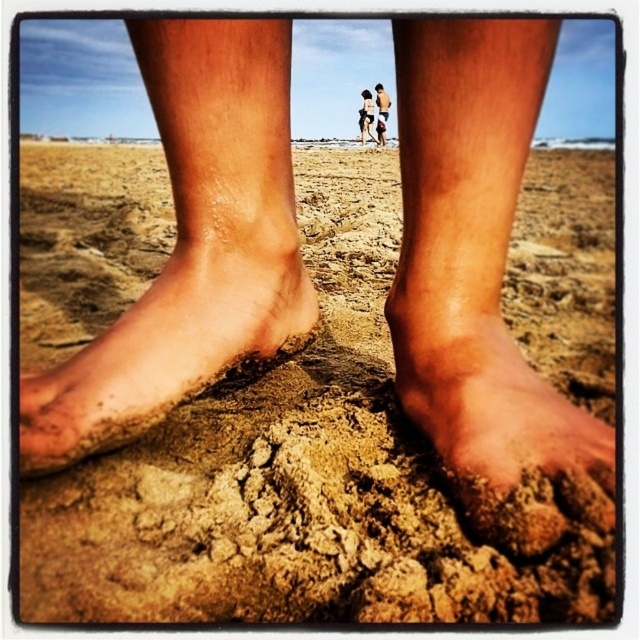
Question: Which object is positioned closest to the dusty sand foot at lower left?

Choices:
 (A) dry sand foot at lower center
 (B) tan skin person at center
 (C) smooth tan skin at center

Answer: (A)

Question: Can you confirm if dry sand at center is thinner than dry sand foot at lower center?

Choices:
 (A) yes
 (B) no

Answer: (B)

Question: Does dry sand at center come in front of smooth tan skin at center?

Choices:
 (A) no
 (B) yes

Answer: (B)

Question: Which object appears closest to the camera in this image?

Choices:
 (A) dry sand at center
 (B) dusty sand foot at lower left

Answer: (A)

Question: Which object is farther from the camera taking this photo?

Choices:
 (A) smooth tan skin at center
 (B) dry sand at center
 (C) tan skin person at center

Answer: (C)

Question: Is dry sand at center to the left of dusty sand foot at lower left from the viewer's perspective?

Choices:
 (A) yes
 (B) no

Answer: (B)